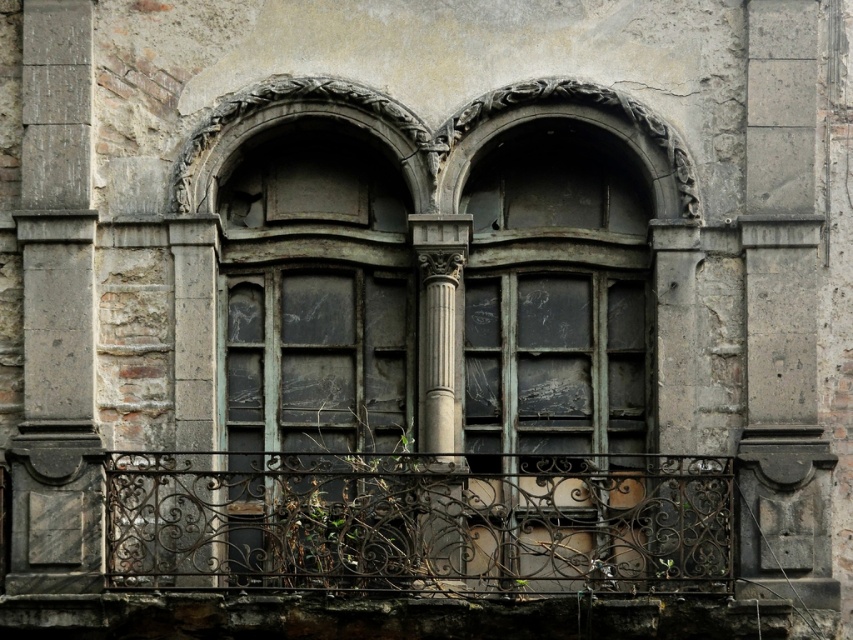
Question: Among these points, which one is farthest from the camera?

Choices:
 (A) (454, 276)
 (B) (448, 588)
 (C) (64, 502)

Answer: (A)

Question: Which of the following is the farthest from the observer?

Choices:
 (A) (53, 296)
 (B) (434, 401)
 (C) (720, 532)

Answer: (A)

Question: Can you confirm if rusty wrought iron railing at center is positioned to the right of gray stone column at center?

Choices:
 (A) no
 (B) yes

Answer: (A)

Question: Which of the following is the closest to the observer?

Choices:
 (A) [x=434, y=554]
 (B) [x=54, y=195]
 (C) [x=193, y=486]

Answer: (A)

Question: Is gray stone column at left thinner than gray stone column at center?

Choices:
 (A) yes
 (B) no

Answer: (B)

Question: Is rusty wrought iron railing at center in front of gray stone column at center?

Choices:
 (A) yes
 (B) no

Answer: (A)